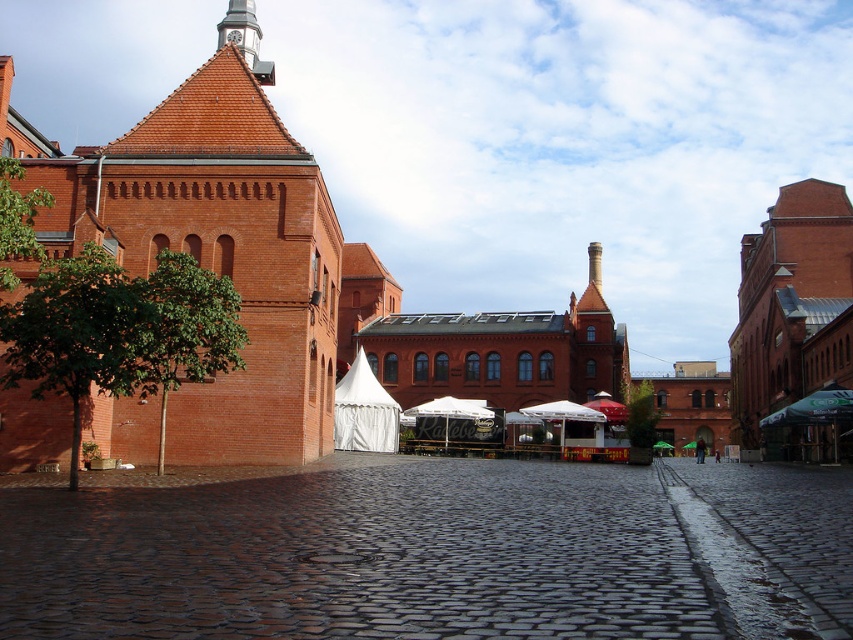
Question: Is dark cobblestone alley at center positioned before white canvas tent at center?

Choices:
 (A) no
 (B) yes

Answer: (B)

Question: Among these points, which one is nearest to the camera?

Choices:
 (A) (338, 404)
 (B) (608, 600)

Answer: (B)

Question: Where is dark cobblestone alley at center located in relation to white canvas tent at center in the image?

Choices:
 (A) right
 (B) left

Answer: (A)

Question: Among these points, which one is farthest from the camera?

Choices:
 (A) (369, 392)
 (B) (305, 493)

Answer: (A)

Question: Is dark cobblestone alley at center below white canvas tent at center?

Choices:
 (A) yes
 (B) no

Answer: (A)